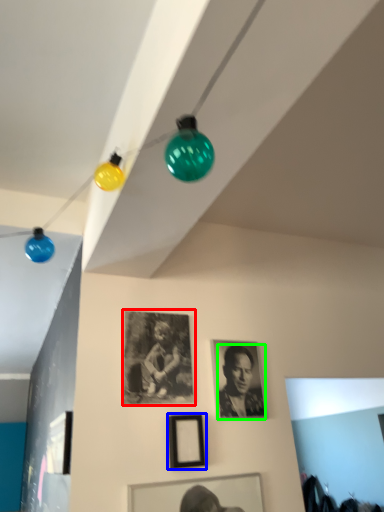
Question: Which is farther away from picture frame (highlighted by a red box)? picture frame (highlighted by a blue box) or person (highlighted by a green box)?

Choices:
 (A) picture frame
 (B) person

Answer: (B)